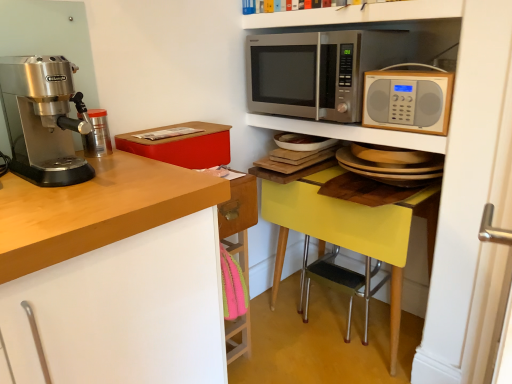
In order to face stainless steel microwave at upper center, the first microwave oven from the back, should I rotate leftwards or rightwards?

You should rotate right by 10.128 degrees.

What do you see at coordinates (317, 71) in the screenshot?
I see `stainless steel microwave at upper center, arranged as the 2th microwave oven when viewed from the front` at bounding box center [317, 71].

Where is `yellow glossy table at lower right`? yellow glossy table at lower right is located at coordinates (423, 216).

At what (x,y) coordinates should I click in order to perform the action: click on pink fabric at lower left. Please return your answer as a coordinate pair (x, y). This screenshot has height=384, width=512. Looking at the image, I should click on (239, 218).

The height and width of the screenshot is (384, 512). Find the location of `metallic silver canister at left`. metallic silver canister at left is located at coordinates tap(97, 134).

In order to face matte red box at upper left, should I rotate leftwards or rightwards?

You should rotate left by 10.410 degrees.

Identify the location of black rubber step stool at lower center. (338, 283).

Identify the location of polished stainless steel espresso machine at left. (42, 119).

Locate an element on the screen. Image resolution: width=512 pixels, height=384 pixels. stainless steel microwave at upper center, arranged as the 2th microwave oven when viewed from the front is located at coordinates (317, 71).

Is pink fabric at lower left completely or partially outside of metallic silver canister at left?

That's correct, pink fabric at lower left is outside of metallic silver canister at left.

Is pink fabric at lower left taller than metallic silver canister at left?

Indeed, pink fabric at lower left has a greater height compared to metallic silver canister at left.

Is pink fabric at lower left far away from metallic silver canister at left?

pink fabric at lower left is near metallic silver canister at left, not far away.

Considering the relative sizes of polished stainless steel espresso machine at left and stainless steel microwave at upper center, the first microwave oven from the back, in the image provided, is polished stainless steel espresso machine at left bigger than stainless steel microwave at upper center, the first microwave oven from the back,?

No.

Can you tell me how much polished stainless steel espresso machine at left and stainless steel microwave at upper center, the first microwave oven from the back, differ in facing direction?

There is a 89.6-degree angle between the facing directions of polished stainless steel espresso machine at left and stainless steel microwave at upper center, the first microwave oven from the back.

Measure the distance from polished stainless steel espresso machine at left to stainless steel microwave at upper center, the first microwave oven from the back.

They are 35.18 inches apart.

Does polished stainless steel espresso machine at left have a lesser width compared to stainless steel microwave at upper center, the first microwave oven from the back?

Yes, polished stainless steel espresso machine at left is thinner than stainless steel microwave at upper center, the first microwave oven from the back.

From a real-world perspective, is black rubber step stool at lower center on polished stainless steel espresso machine at left?

No.

Is black rubber step stool at lower center in front of or behind polished stainless steel espresso machine at left in the image?

black rubber step stool at lower center is positioned farther from the viewer than polished stainless steel espresso machine at left.

From the image's perspective, which is above, black rubber step stool at lower center or polished stainless steel espresso machine at left?

polished stainless steel espresso machine at left is shown above in the image.

Is black rubber step stool at lower center looking in the opposite direction of polished stainless steel espresso machine at left?

black rubber step stool at lower center does not have its back to polished stainless steel espresso machine at left.

Would you say white glossy shelf at upper center, acting as the first shelf starting from the top, is inside or outside yellow glossy table at lower right?

white glossy shelf at upper center, acting as the first shelf starting from the top, cannot be found inside yellow glossy table at lower right.

Is white glossy shelf at upper center, marked as the 2th shelf in a bottom-to-top arrangement, positioned with its back to yellow glossy table at lower right?

No, white glossy shelf at upper center, marked as the 2th shelf in a bottom-to-top arrangement,'s orientation is not away from yellow glossy table at lower right.

Can you confirm if white glossy shelf at upper center, acting as the first shelf starting from the top, is smaller than yellow glossy table at lower right?

Indeed, white glossy shelf at upper center, acting as the first shelf starting from the top, has a smaller size compared to yellow glossy table at lower right.

From the image's perspective, which is above, white glossy shelf at upper center, marked as the 2th shelf in a bottom-to-top arrangement, or yellow glossy table at lower right?

white glossy shelf at upper center, marked as the 2th shelf in a bottom-to-top arrangement.

In the scene shown: Considering the relative positions of polished stainless steel espresso machine at left and pink fabric at lower left in the image provided, is polished stainless steel espresso machine at left behind pink fabric at lower left?

That is False.

From a real-world perspective, which is physically above, polished stainless steel espresso machine at left or pink fabric at lower left?

In real-world perspective, polished stainless steel espresso machine at left is above.

Based on the photo, how much distance is there between polished stainless steel espresso machine at left and pink fabric at lower left?

polished stainless steel espresso machine at left is 21.32 inches away from pink fabric at lower left.

Is polished stainless steel espresso machine at left taller than pink fabric at lower left?

No, polished stainless steel espresso machine at left is not taller than pink fabric at lower left.

Is white glossy shelf at upper center, acting as the first shelf starting from the top, positioned far away from stainless steel microwave at upper center, the first microwave oven from the back?

No, there isn't a large distance between white glossy shelf at upper center, acting as the first shelf starting from the top, and stainless steel microwave at upper center, the first microwave oven from the back.

Is white glossy shelf at upper center, marked as the 2th shelf in a bottom-to-top arrangement, facing away from stainless steel microwave at upper center, arranged as the 2th microwave oven when viewed from the front?

Result: white glossy shelf at upper center, marked as the 2th shelf in a bottom-to-top arrangement, does not have its back to stainless steel microwave at upper center, arranged as the 2th microwave oven when viewed from the front.

Which is closer to the camera, (284,21) or (328,54)?

Point (284,21) is farther from the camera than point (328,54).

Is white glossy shelf at upper center, acting as the first shelf starting from the top, further to the viewer compared to stainless steel microwave at upper center, the first microwave oven from the back?

No, white glossy shelf at upper center, acting as the first shelf starting from the top, is closer to the viewer.

Considering the sizes of objects metallic silver canister at left and black rubber step stool at lower center in the image provided, who is taller, metallic silver canister at left or black rubber step stool at lower center?

With more height is black rubber step stool at lower center.

Based on the photo, is metallic silver canister at left to the right of black rubber step stool at lower center from the viewer's perspective?

In fact, metallic silver canister at left is to the left of black rubber step stool at lower center.

From a real-world perspective, is metallic silver canister at left above or below black rubber step stool at lower center?

In terms of real-world spatial position, metallic silver canister at left is above black rubber step stool at lower center.

From the image's perspective, would you say metallic silver canister at left is shown under black rubber step stool at lower center?

No, from the image's perspective, metallic silver canister at left is not below black rubber step stool at lower center.

Locate an element on the screen. The width and height of the screenshot is (512, 384). appliance located above the pink fabric at lower left (from a real-world perspective) is located at coordinates (97, 134).

Where is `the 1st microwave oven to the right of the polished stainless steel espresso machine at left, starting your count from the anchor`? the 1st microwave oven to the right of the polished stainless steel espresso machine at left, starting your count from the anchor is located at coordinates (317, 71).

Which object lies nearer to the anchor point metallic silver canister at left, metallic silver microwave at upper center, the second shelf when ordered from top to bottom, or white glossy shelf at upper center, acting as the first shelf starting from the top?

Based on the image, metallic silver microwave at upper center, the second shelf when ordered from top to bottom, appears to be nearer to metallic silver canister at left.

Which object lies nearer to the anchor point polished stainless steel espresso machine at left, white glossy shelf at upper center, acting as the first shelf starting from the top, or stainless steel microwave at upper center, the first microwave oven from the back?

stainless steel microwave at upper center, the first microwave oven from the back.

Based on their spatial positions, is silver metallic microwave at upper right, the first microwave oven in the front-to-back sequence, or black rubber step stool at lower center closer to matte red box at upper left?

silver metallic microwave at upper right, the first microwave oven in the front-to-back sequence, lies closer to matte red box at upper left than the other object.

Based on their spatial positions, is white glossy shelf at upper center, acting as the first shelf starting from the top, or metallic silver microwave at upper center, the first shelf from the bottom, closer to pink fabric at lower left?

Among the two, metallic silver microwave at upper center, the first shelf from the bottom, is located nearer to pink fabric at lower left.

Consider the image. Considering their positions, is yellow glossy table at lower right positioned closer to white glossy shelf at upper center, acting as the first shelf starting from the top, than metallic silver microwave at upper center, the second shelf when ordered from top to bottom?

Based on the image, metallic silver microwave at upper center, the second shelf when ordered from top to bottom, appears to be nearer to white glossy shelf at upper center, acting as the first shelf starting from the top.

Consider the image. Looking at the image, which one is located further to stainless steel microwave at upper center, the first microwave oven from the back, yellow glossy table at lower right or metallic silver canister at left?

metallic silver canister at left lies further to stainless steel microwave at upper center, the first microwave oven from the back, than the other object.

Estimate the real-world distances between objects in this image. Which object is closer to pink fabric at lower left, polished stainless steel espresso machine at left or metallic silver canister at left?

metallic silver canister at left lies closer to pink fabric at lower left than the other object.

Estimate the real-world distances between objects in this image. Which object is closer to stainless steel microwave at upper center, the first microwave oven from the back, white glossy shelf at upper center, acting as the first shelf starting from the top, or yellow glossy table at lower right?

white glossy shelf at upper center, acting as the first shelf starting from the top, is closer to stainless steel microwave at upper center, the first microwave oven from the back.

The width and height of the screenshot is (512, 384). What are the coordinates of `microwave oven between stainless steel microwave at upper center, the first microwave oven from the back, and pink fabric at lower left in the up-down direction` in the screenshot? It's located at click(x=408, y=99).

I want to click on shelf between white glossy shelf at upper center, marked as the 2th shelf in a bottom-to-top arrangement, and pink fabric at lower left in the up-down direction, so click(x=350, y=132).

This screenshot has height=384, width=512. What are the coordinates of `table between stainless steel microwave at upper center, arranged as the 2th microwave oven when viewed from the front, and black rubber step stool at lower center vertically` in the screenshot? It's located at (423, 216).

Where is `table between polished stainless steel espresso machine at left and silver metallic microwave at upper right, the second microwave oven when ordered from back to front, from left to right`? This screenshot has width=512, height=384. table between polished stainless steel espresso machine at left and silver metallic microwave at upper right, the second microwave oven when ordered from back to front, from left to right is located at coordinates (423, 216).